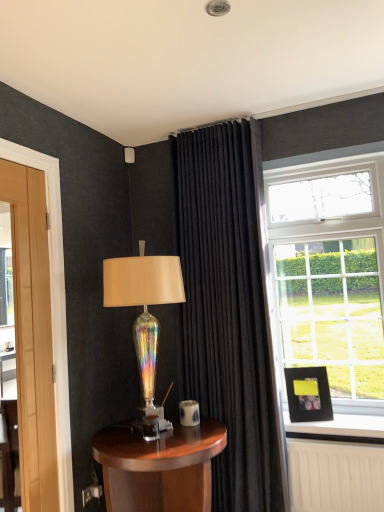
Question: Relative to wooden table at lower center, is black matte picture frame at right in front or behind?

Choices:
 (A) behind
 (B) front

Answer: (A)

Question: Is black matte picture frame at right bigger or smaller than wooden table at lower center?

Choices:
 (A) big
 (B) small

Answer: (B)

Question: Which object is positioned farthest from the black velvet curtain at center?

Choices:
 (A) iridescent glass lamp at center
 (B) wooden table at lower center
 (C) black matte picture frame at right

Answer: (B)

Question: Estimate the real-world distances between objects in this image. Which object is farther from the wooden table at lower center?

Choices:
 (A) black matte picture frame at right
 (B) iridescent glass lamp at center
 (C) black velvet curtain at center

Answer: (A)